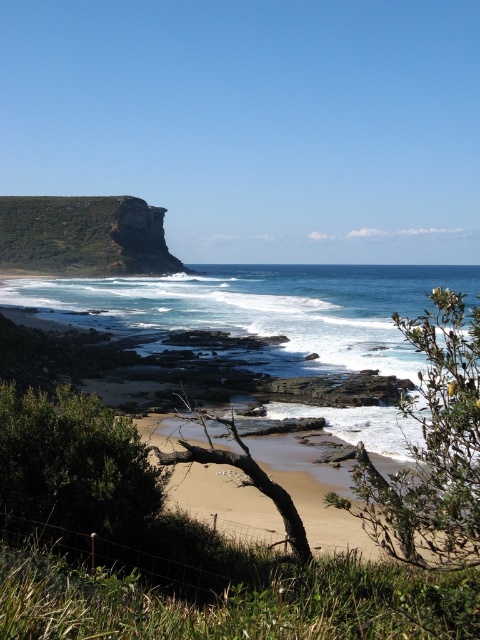
Question: Can you confirm if light brown sandy beach at center is bigger than green grassy cliff at upper left?

Choices:
 (A) yes
 (B) no

Answer: (B)

Question: Which of the following is the farthest from the observer?

Choices:
 (A) (12, 257)
 (B) (229, 497)

Answer: (A)

Question: Is light brown sandy beach at center above green grassy cliff at upper left?

Choices:
 (A) no
 (B) yes

Answer: (A)

Question: Which object is closer to the camera taking this photo?

Choices:
 (A) light brown sandy beach at center
 (B) green grassy cliff at upper left

Answer: (A)

Question: Is light brown sandy beach at center to the left of green grassy cliff at upper left from the viewer's perspective?

Choices:
 (A) no
 (B) yes

Answer: (A)

Question: Which object is closer to the camera taking this photo?

Choices:
 (A) light brown sandy beach at center
 (B) green grassy cliff at upper left

Answer: (A)